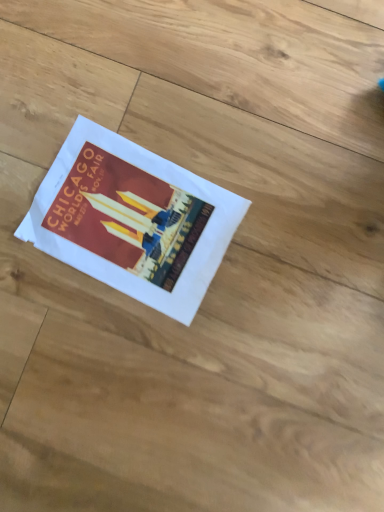
You are a GUI agent. You are given a task and a screenshot of the screen. Output one action in this format:
    pyautogui.click(x=<x>, y=<y>)
    Task: Click on the empty space that is ontop of white paper at center (from a real-world perspective)
    
    Given the screenshot: What is the action you would take?
    pyautogui.click(x=128, y=217)